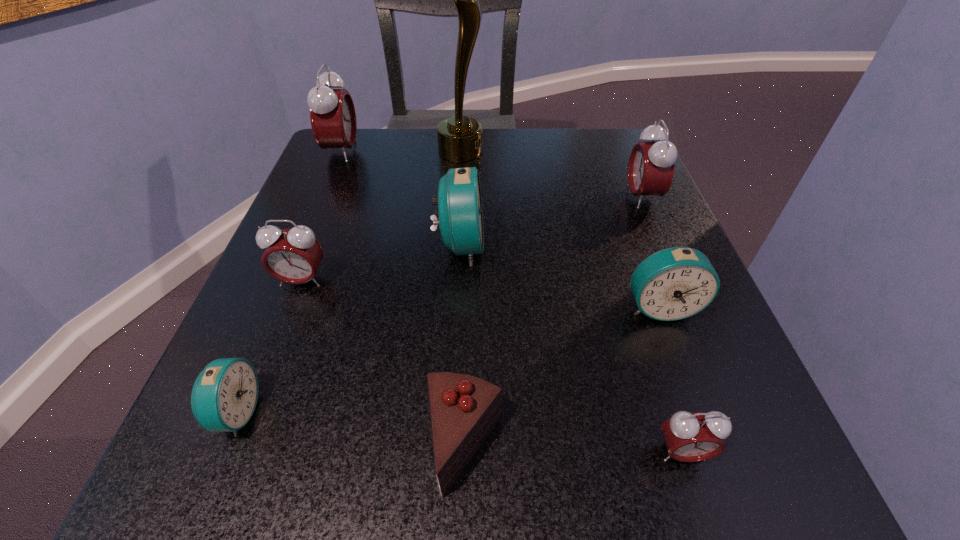
What are the coordinates of `vacant region located 0.210m on the clock face of the rightmost pink alarm clock` in the screenshot? It's located at (519, 197).

Where is `free space located 0.140m on the clock face of the second smallest pink alarm clock`? free space located 0.140m on the clock face of the second smallest pink alarm clock is located at coordinates (269, 368).

At what (x,y) coordinates should I click in order to perform the action: click on vacant space located on the front-facing side of the rightmost blue alarm clock. Please return your answer as a coordinate pair (x, y). The height and width of the screenshot is (540, 960). Looking at the image, I should click on (692, 393).

Identify the location of free space located 0.240m on the front-facing side of the smallest blue alarm clock. (451, 412).

Where is `vacant area situated 0.200m on the back of the chocolate cake`? Image resolution: width=960 pixels, height=540 pixels. vacant area situated 0.200m on the back of the chocolate cake is located at coordinates (468, 284).

The width and height of the screenshot is (960, 540). Find the location of `award positioned at the far edge`. award positioned at the far edge is located at coordinates (460, 138).

Find the location of `chocolate cake that is positioned at the near edge`. chocolate cake that is positioned at the near edge is located at coordinates (464, 409).

The height and width of the screenshot is (540, 960). In order to click on object situated at the far left corner in this screenshot , I will do `click(332, 113)`.

Locate an element on the screen. Image resolution: width=960 pixels, height=540 pixels. object that is at the near left corner is located at coordinates pyautogui.click(x=224, y=396).

Identify the location of object positioned at the far right corner. The width and height of the screenshot is (960, 540). (651, 165).